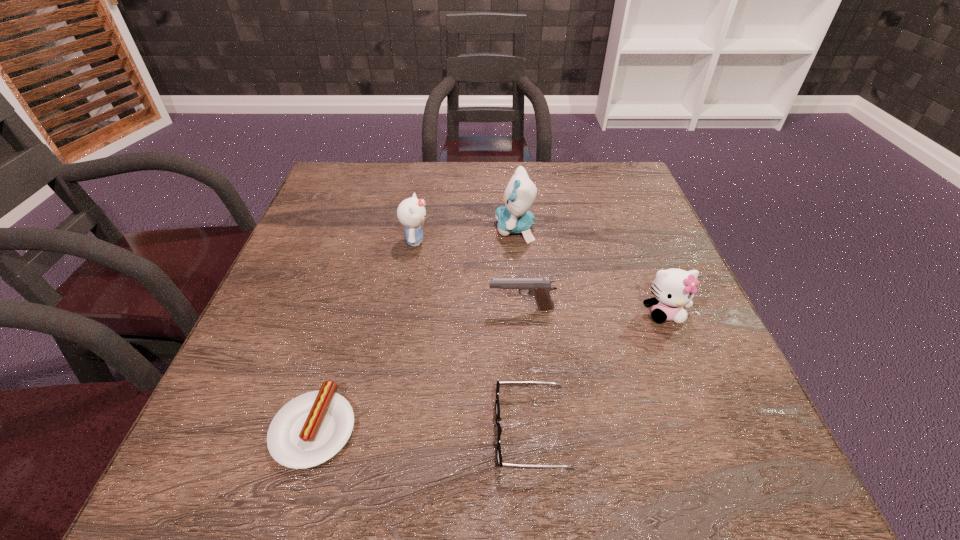
This screenshot has width=960, height=540. I want to click on free space at the far right corner of the desktop, so click(622, 187).

Find the location of a particular element. The width and height of the screenshot is (960, 540). free space between the leftmost kitten and the nearest kitten is located at coordinates (540, 277).

Locate an element on the screen. free space between the pistol and the spectacles is located at coordinates (526, 370).

Image resolution: width=960 pixels, height=540 pixels. In order to click on blank region between the pistol and the fifth tallest object in this screenshot , I will do `click(526, 370)`.

The height and width of the screenshot is (540, 960). Find the location of `free space that is in between the spectacles and the tallest object`. free space that is in between the spectacles and the tallest object is located at coordinates tap(523, 330).

The height and width of the screenshot is (540, 960). I want to click on vacant region between the sausage and the tallest object, so click(x=415, y=328).

Where is `free area in between the second kitten from right to left and the pistol`? This screenshot has height=540, width=960. free area in between the second kitten from right to left and the pistol is located at coordinates (518, 269).

The width and height of the screenshot is (960, 540). What are the coordinates of `vacant region between the spectacles and the leftmost kitten` in the screenshot? It's located at click(473, 336).

Where is `vacant area between the nearest kitten and the pistol`? vacant area between the nearest kitten and the pistol is located at coordinates (593, 311).

Identify the location of vacant area that lies between the rightmost object and the shortest object. The width and height of the screenshot is (960, 540). (490, 370).